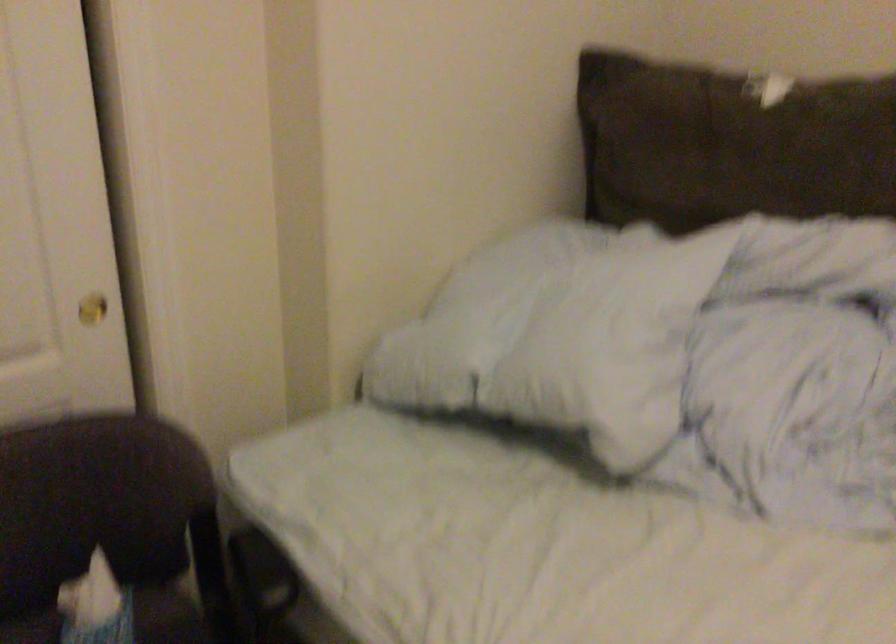
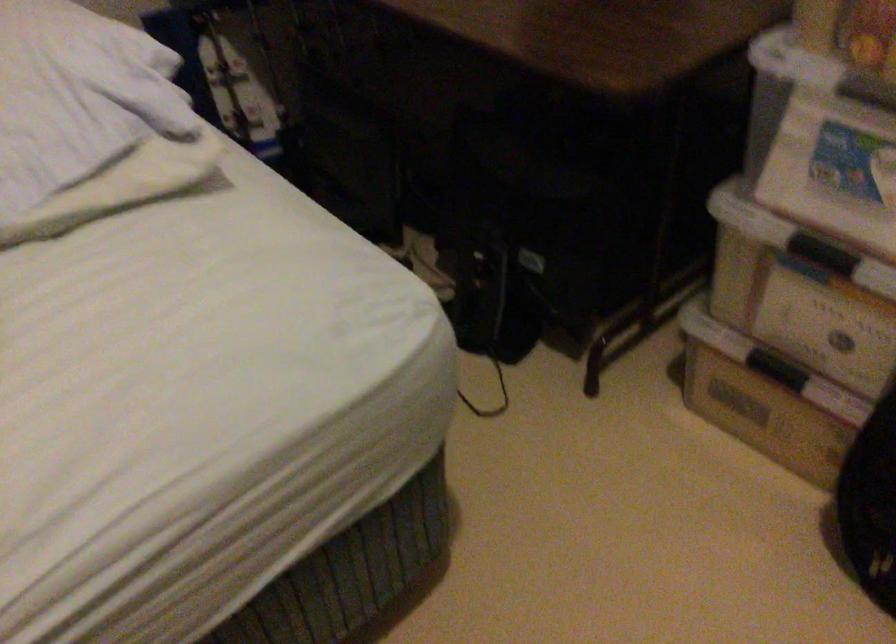
How did the camera likely rotate?

The camera's rotation is toward right-down.